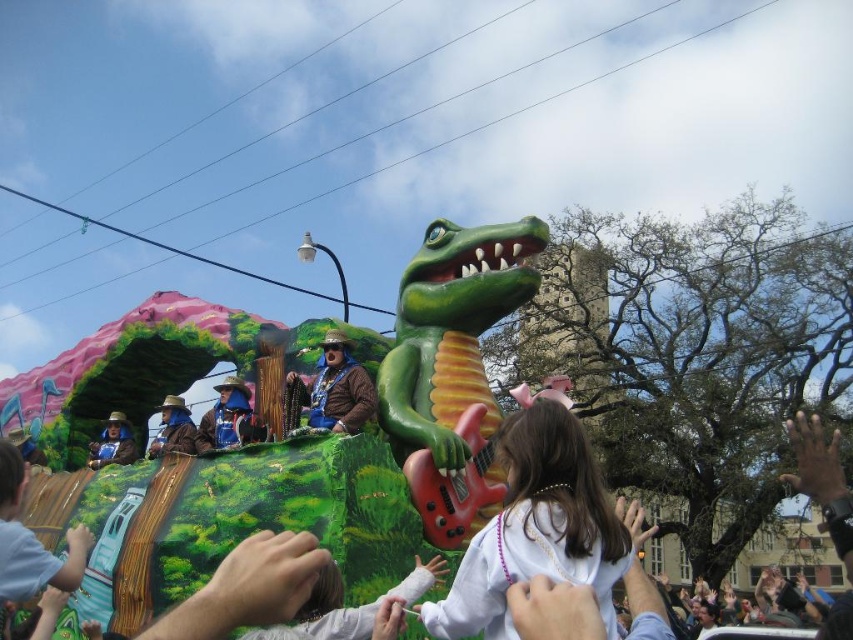
You are standing at the parade and want to take a photo of the brown leather jacket at center. If your camera can focus on objects up to 60 meters away, will you be able to capture a clear photo?

The brown leather jacket at center is 64.87 meters away from the viewer, which exceeds the camera focus limit of 60 meters. Therefore, the photo may not be clear.

You are a photographer trying to capture the float from the front. You notice the white pearl necklace at center and the blue velvet hat at center. Which object should you focus on if you want to ensure the one closer to the camera is sharp?

The white pearl necklace at center is in front of the blue velvet hat at center, so focusing on the white pearl necklace at center will ensure the closer object is sharp.